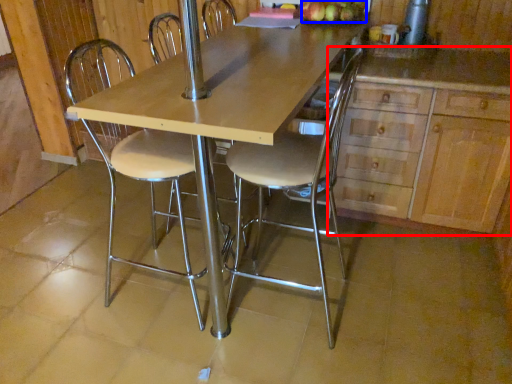
Question: Which object appears closest to the camera in this image, cabinetry (highlighted by a red box) or apple (highlighted by a blue box)?

Choices:
 (A) cabinetry
 (B) apple

Answer: (A)